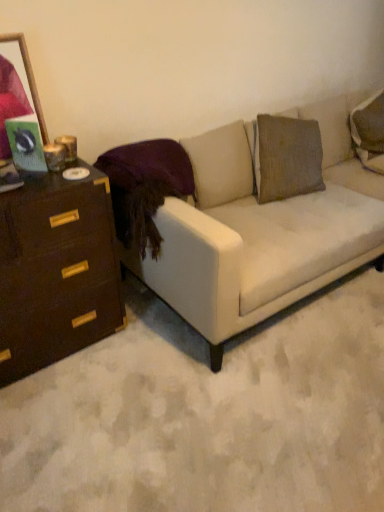
Question: Would you say white fabric couch at center is part of velvet purple pillow at upper left's contents?

Choices:
 (A) yes
 (B) no

Answer: (B)

Question: From the image's perspective, is velvet purple pillow at upper left under white fabric couch at center?

Choices:
 (A) yes
 (B) no

Answer: (B)

Question: Can you confirm if velvet purple pillow at upper left is positioned to the right of white fabric couch at center?

Choices:
 (A) no
 (B) yes

Answer: (A)

Question: Is velvet purple pillow at upper left positioned behind white fabric couch at center?

Choices:
 (A) yes
 (B) no

Answer: (A)

Question: Is velvet purple pillow at upper left closer to camera compared to white fabric couch at center?

Choices:
 (A) yes
 (B) no

Answer: (B)

Question: Considering the positions of velvet purple pillow at upper left and wooden picture frame at upper left in the image, is velvet purple pillow at upper left wider or thinner than wooden picture frame at upper left?

Choices:
 (A) thin
 (B) wide

Answer: (B)

Question: Considering the relative positions of velvet purple pillow at upper left and wooden picture frame at upper left in the image provided, is velvet purple pillow at upper left to the left or to the right of wooden picture frame at upper left?

Choices:
 (A) right
 (B) left

Answer: (A)

Question: From the image's perspective, is velvet purple pillow at upper left above or below wooden picture frame at upper left?

Choices:
 (A) below
 (B) above

Answer: (A)

Question: From a real-world perspective, is velvet purple pillow at upper left above or below wooden picture frame at upper left?

Choices:
 (A) below
 (B) above

Answer: (A)

Question: Based on their positions, is wooden picture frame at upper left located to the left or right of dark brown wood chest of drawers at left?

Choices:
 (A) right
 (B) left

Answer: (B)

Question: From the image's perspective, is wooden picture frame at upper left positioned above or below dark brown wood chest of drawers at left?

Choices:
 (A) above
 (B) below

Answer: (A)

Question: From a real-world perspective, relative to dark brown wood chest of drawers at left, is wooden picture frame at upper left vertically above or below?

Choices:
 (A) below
 (B) above

Answer: (B)

Question: Is wooden picture frame at upper left wider or thinner than dark brown wood chest of drawers at left?

Choices:
 (A) wide
 (B) thin

Answer: (B)

Question: From their relative heights in the image, would you say wooden picture frame at upper left is taller or shorter than white fabric couch at center?

Choices:
 (A) tall
 (B) short

Answer: (B)

Question: Considering the relative positions of wooden picture frame at upper left and white fabric couch at center in the image provided, is wooden picture frame at upper left to the left or to the right of white fabric couch at center?

Choices:
 (A) right
 (B) left

Answer: (B)